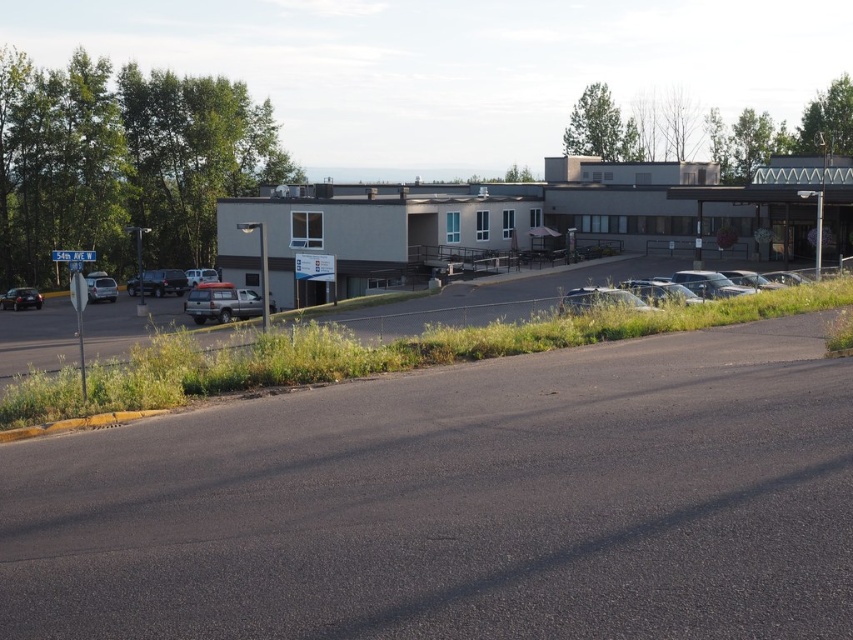
Question: Which of these objects is positioned farthest from the matte silver sedan at left?

Choices:
 (A) silver metallic van at center
 (B) shiny black suv at left

Answer: (A)

Question: Does metallic silver car at center appear on the left side of shiny black suv at left?

Choices:
 (A) no
 (B) yes

Answer: (A)

Question: Is shiny black suv at left positioned before silver metallic van at center?

Choices:
 (A) no
 (B) yes

Answer: (B)

Question: Does asphalt pavement at lower center have a greater width compared to matte silver sedan at left?

Choices:
 (A) yes
 (B) no

Answer: (B)

Question: Which object is closer to the camera taking this photo?

Choices:
 (A) asphalt pavement at lower center
 (B) matte silver sedan at left

Answer: (A)

Question: Which is nearer to the matte silver sedan at left?

Choices:
 (A) metallic silver car at center
 (B) satin silver suv at center

Answer: (B)